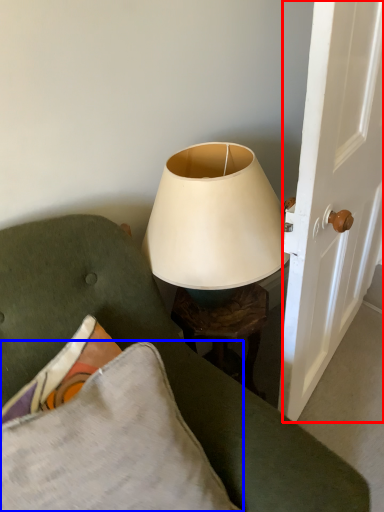
Question: Which object is closer to the camera taking this photo, screen door (highlighted by a red box) or pillow (highlighted by a blue box)?

Choices:
 (A) screen door
 (B) pillow

Answer: (B)